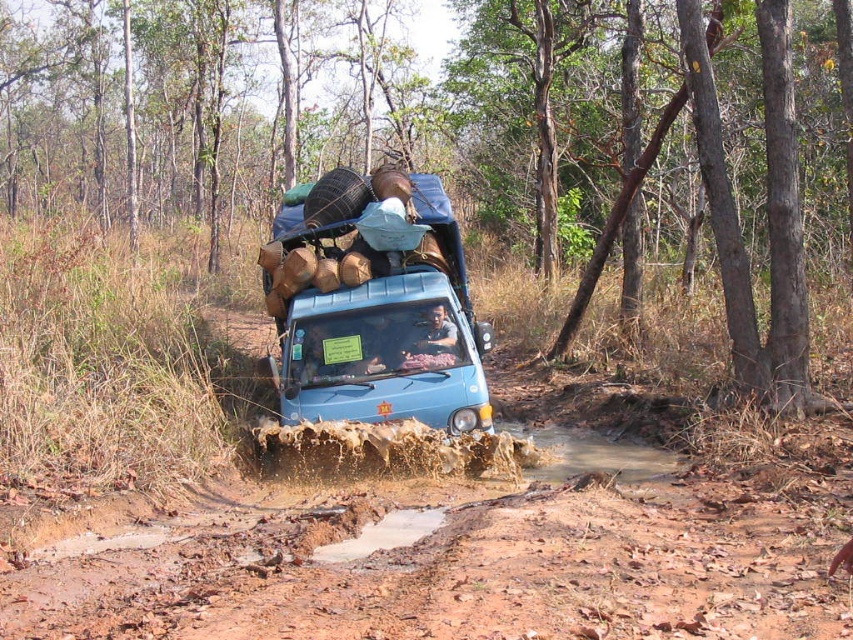
You are a passenger in the blue vehicle and want to know which of the two points, point (70, 580) or point (389, 412), is closer to you. Can you determine this based on the scene?

Point (70, 580) is closer to the viewer than point (389, 412), so the passenger should know that point (70, 580) is closer.

You are driving a blue matte truck at center on a brown muddy dirt track at center. Can the truck safely pass through the track without getting stuck? Explain why based on the track and truck dimensions.

The brown muddy dirt track at center is wider than the blue matte truck at center, so the truck can safely pass through the track without getting stuck as the track provides sufficient width for the vehicle.